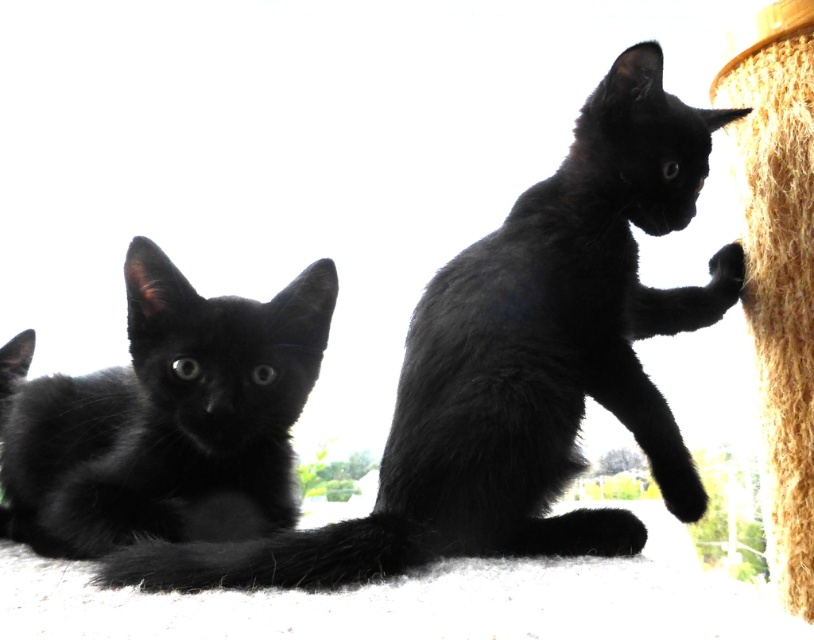
Question: Which of the following is the farthest from the observer?

Choices:
 (A) matte black kitten at left
 (B) coarse straw rope at right

Answer: (B)

Question: Does black fur cat at center appear on the right side of matte black kitten at left?

Choices:
 (A) yes
 (B) no

Answer: (A)

Question: Is black fur cat at center below matte black kitten at left?

Choices:
 (A) yes
 (B) no

Answer: (B)

Question: Which object is the farthest from the matte black kitten at left?

Choices:
 (A) black fur cat at center
 (B) coarse straw rope at right

Answer: (B)

Question: Is matte black kitten at left wider than coarse straw rope at right?

Choices:
 (A) yes
 (B) no

Answer: (A)

Question: Which is nearer to the coarse straw rope at right?

Choices:
 (A) black fur cat at center
 (B) matte black kitten at left

Answer: (A)